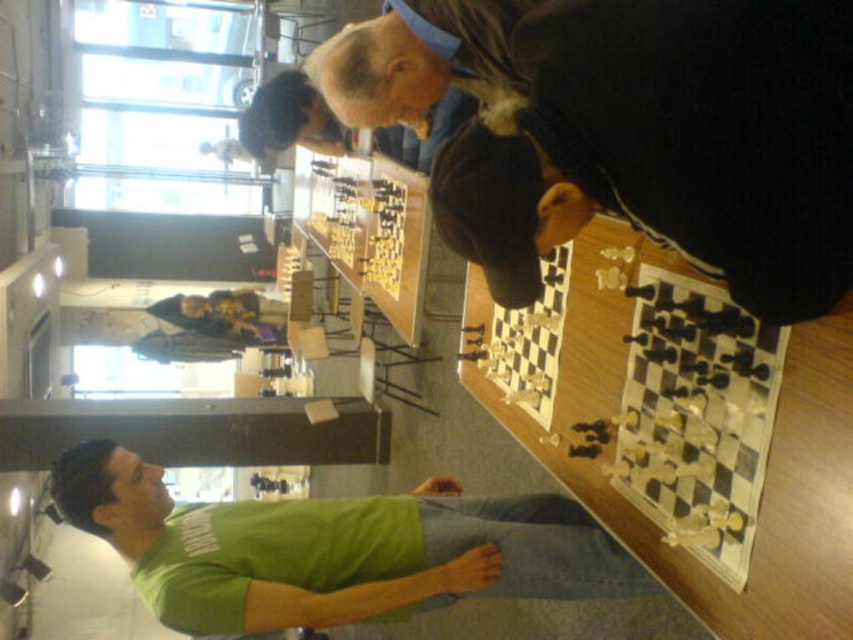
Question: Which point is closer to the camera?

Choices:
 (A) black matte chessboard at upper center
 (B) green matte shirt at lower left

Answer: (A)

Question: Which point is closer to the camera?

Choices:
 (A) (509, 595)
 (B) (480, 93)

Answer: (B)

Question: From the image, what is the correct spatial relationship of black matte chessboard at upper center in relation to green matte shirt at lower left?

Choices:
 (A) right
 (B) left

Answer: (A)

Question: Can you confirm if black matte chessboard at upper center is positioned above green matte shirt at lower left?

Choices:
 (A) no
 (B) yes

Answer: (B)

Question: Can you confirm if black matte chessboard at upper center is positioned below green matte shirt at lower left?

Choices:
 (A) yes
 (B) no

Answer: (B)

Question: Which of the following is the closest to the observer?

Choices:
 (A) black matte chessboard at upper center
 (B) green matte shirt at lower left

Answer: (A)